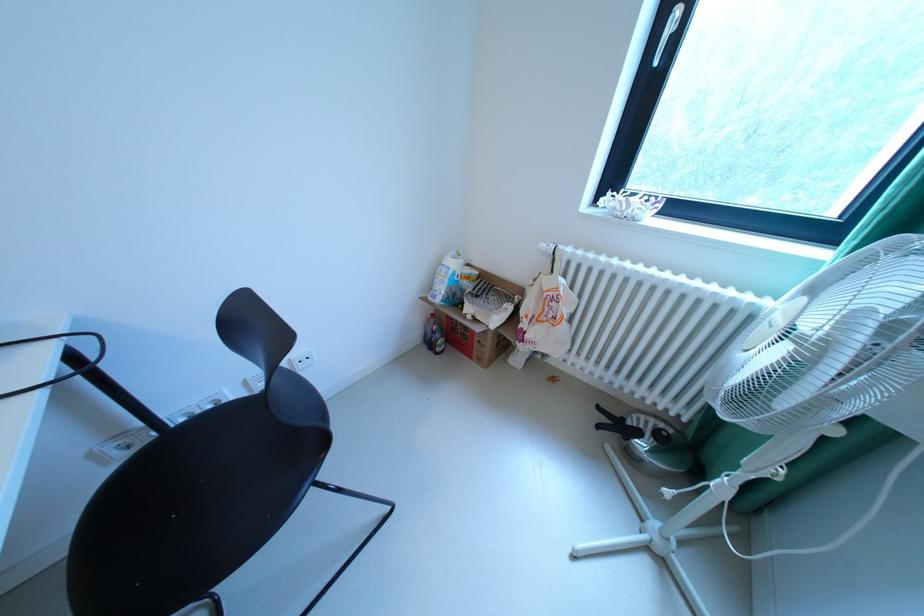
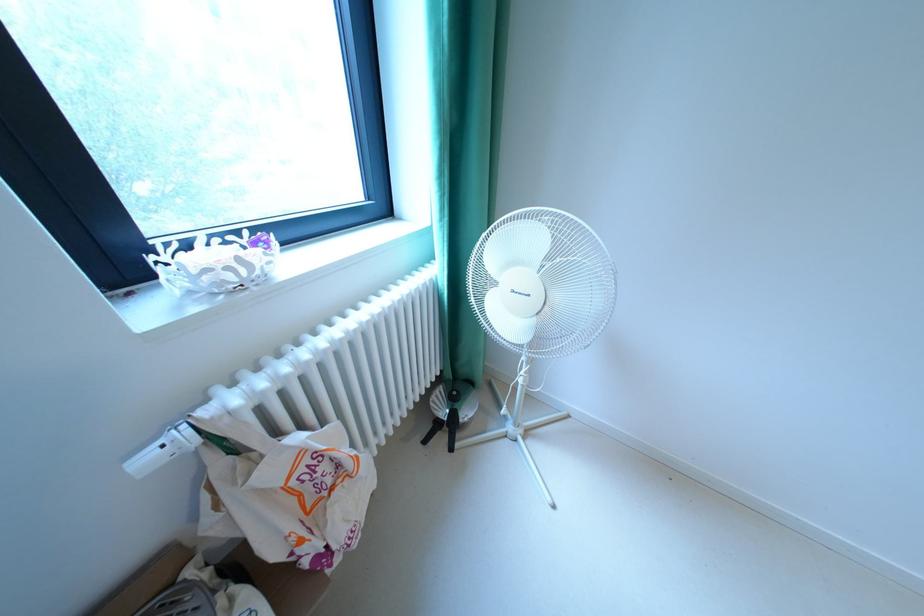
In the second image, find the point that corresponds to pixel 639 212 in the first image.

(268, 273)